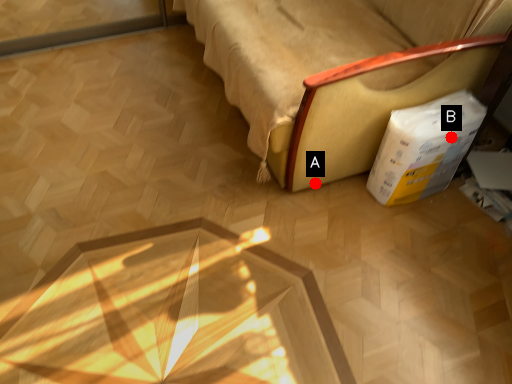
Question: Two points are circled on the image, labeled by A and B beside each circle. Which of the following is the farthest from the observer?

Choices:
 (A) A is further
 (B) B is further

Answer: (A)